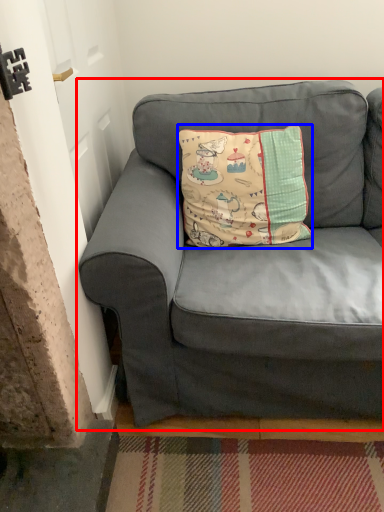
Question: Which object appears farthest to the camera in this image, studio couch (highlighted by a red box) or pillow (highlighted by a blue box)?

Choices:
 (A) studio couch
 (B) pillow

Answer: (B)